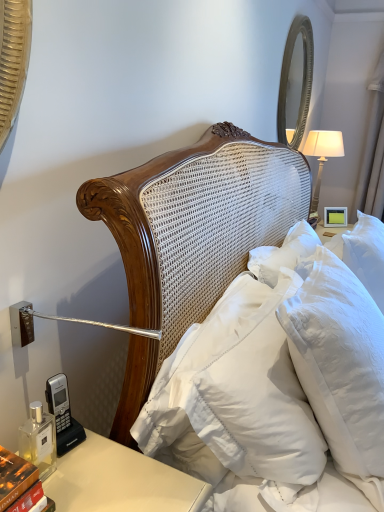
Question: Considering the relative sizes of hardcover book at lower left and white soft pillow at center, the first pillow positioned from the left, in the image provided, is hardcover book at lower left thinner than white soft pillow at center, the first pillow positioned from the left,?

Choices:
 (A) no
 (B) yes

Answer: (B)

Question: From the image's perspective, is hardcover book at lower left over white soft pillow at center, the first pillow positioned from the left?

Choices:
 (A) yes
 (B) no

Answer: (B)

Question: From a real-world perspective, is hardcover book at lower left physically above white soft pillow at center, the 2th pillow positioned from the right?

Choices:
 (A) no
 (B) yes

Answer: (B)

Question: Does hardcover book at lower left turn towards white soft pillow at center, the first pillow positioned from the left?

Choices:
 (A) yes
 (B) no

Answer: (B)

Question: Is hardcover book at lower left positioned before white soft pillow at center, the 2th pillow positioned from the right?

Choices:
 (A) yes
 (B) no

Answer: (A)

Question: In terms of height, does white soft pillow at center, the 2th pillow positioned from the right, look taller or shorter compared to silver textured mirror at upper right?

Choices:
 (A) short
 (B) tall

Answer: (A)

Question: From a real-world perspective, is white soft pillow at center, the 2th pillow positioned from the right, above or below silver textured mirror at upper right?

Choices:
 (A) above
 (B) below

Answer: (B)

Question: Considering their positions, is white soft pillow at center, the 2th pillow positioned from the right, located in front of or behind silver textured mirror at upper right?

Choices:
 (A) front
 (B) behind

Answer: (A)

Question: Visually, is white soft pillow at center, the first pillow positioned from the left, positioned to the left or to the right of silver textured mirror at upper right?

Choices:
 (A) right
 (B) left

Answer: (B)

Question: Relative to white fabric lampshade at upper right, is white soft pillow at center, the 2th pillow positioned from the right, in front or behind?

Choices:
 (A) front
 (B) behind

Answer: (A)

Question: From a real-world perspective, is white soft pillow at center, the 2th pillow positioned from the right, above or below white fabric lampshade at upper right?

Choices:
 (A) above
 (B) below

Answer: (B)

Question: Considering the positions of point [x=306, y=438] and point [x=334, y=146], is point [x=306, y=438] closer or farther from the camera than point [x=334, y=146]?

Choices:
 (A) farther
 (B) closer

Answer: (B)

Question: Would you say white soft pillow at center, the first pillow positioned from the left, is to the left or to the right of white fabric lampshade at upper right in the picture?

Choices:
 (A) right
 (B) left

Answer: (B)

Question: Looking at their shapes, would you say white soft pillow at upper right, the second pillow from the left, is wider or thinner than silver textured mirror at upper right?

Choices:
 (A) wide
 (B) thin

Answer: (A)

Question: Does point (329, 422) appear closer or farther from the camera than point (279, 138)?

Choices:
 (A) closer
 (B) farther

Answer: (A)